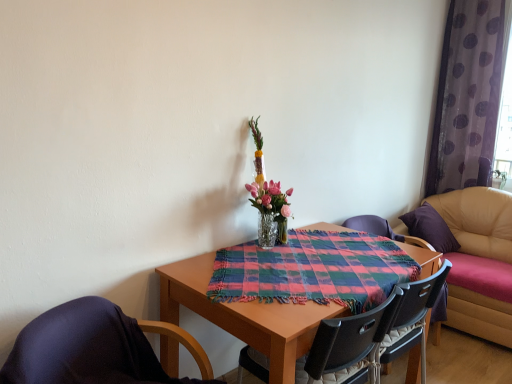
Identify the location of vacant area situated below clear glass vase at center (from a real-world perspective). (262, 246).